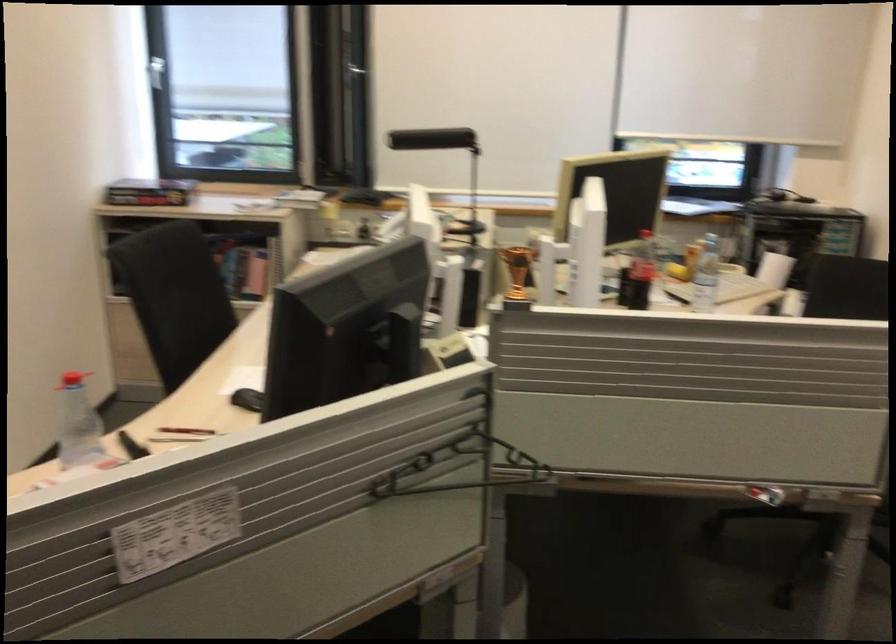
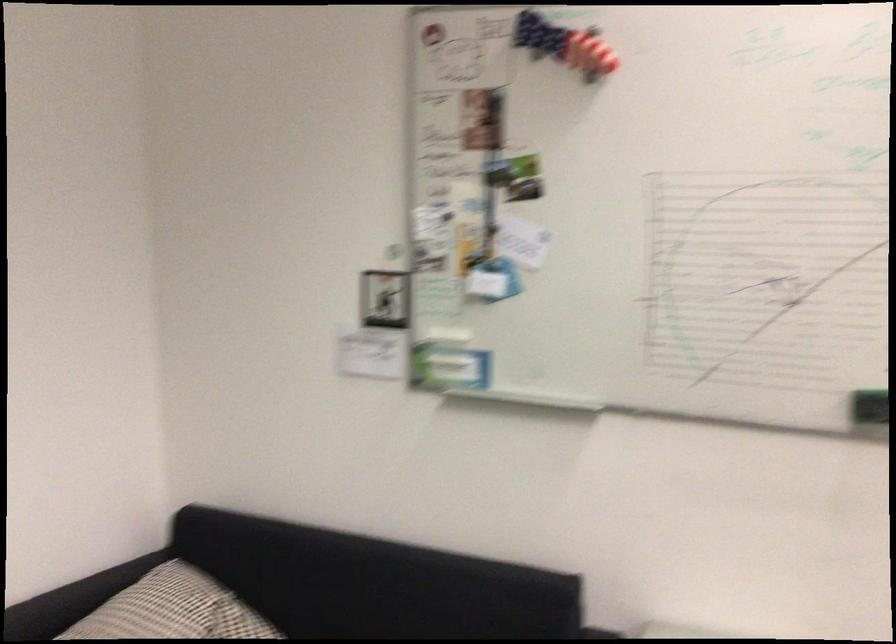
Question: The first image is from the beginning of the video and the second image is from the end. How did the camera likely rotate when shooting the video?

Choices:
 (A) Left
 (B) Right
 (C) Up
 (D) Down

Answer: (A)